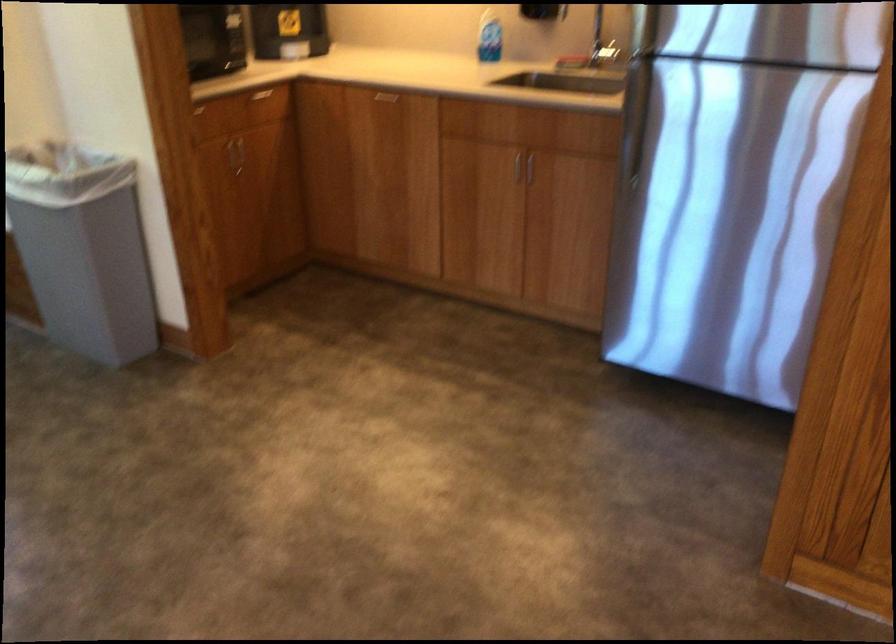
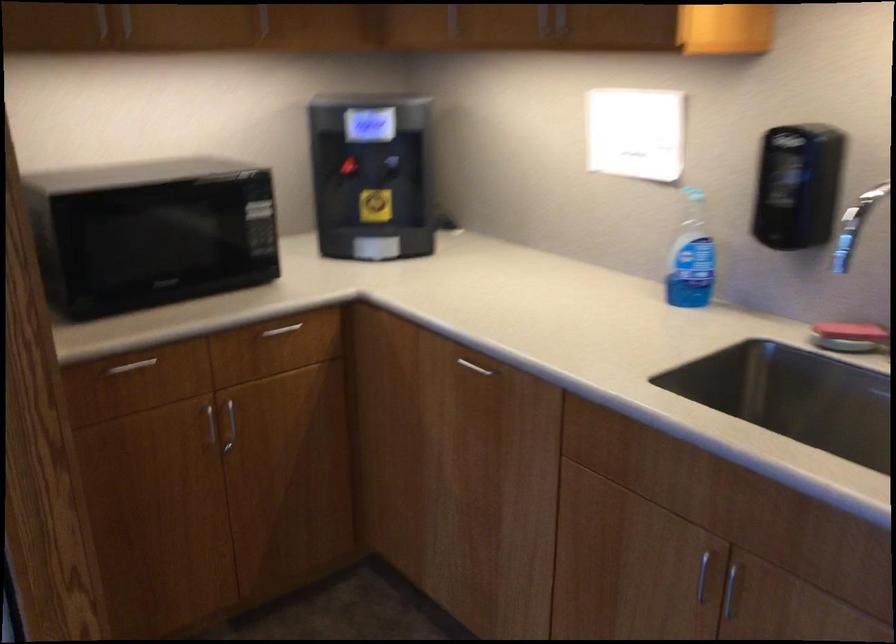
Find the pixel in the second image that matches pixel 236 158 in the first image.

(229, 426)